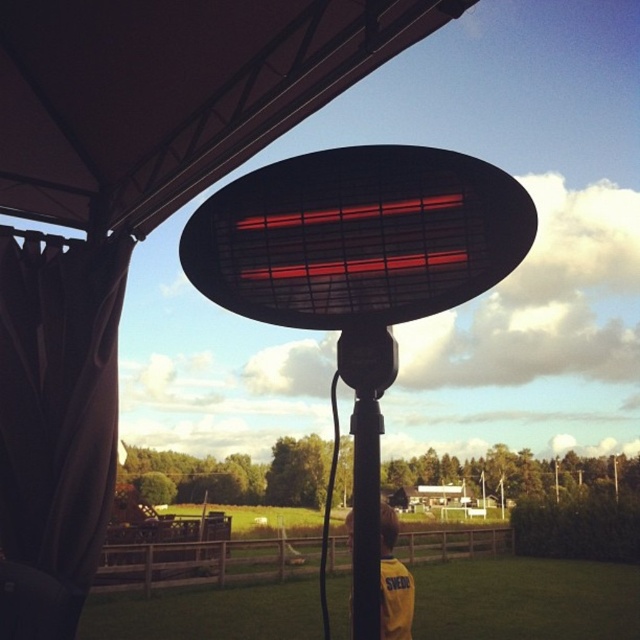
Question: Which point is farther to the camera?

Choices:
 (A) (374, 468)
 (B) (170, 49)
 (C) (490, 266)

Answer: (B)

Question: Which point is farther from the camera taking this photo?

Choices:
 (A) (403, 576)
 (B) (387, 216)
 (C) (358, 595)
 (D) (141, 236)

Answer: (D)

Question: Can you confirm if matte black canopy at upper center is smaller than black matte pole at center?

Choices:
 (A) no
 (B) yes

Answer: (A)

Question: In this image, where is black matte infrared heater at center located relative to yellow fabric at lower center?

Choices:
 (A) above
 (B) below

Answer: (A)

Question: Which point is farther to the camera?

Choices:
 (A) black matte infrared heater at center
 (B) black matte pole at center

Answer: (B)

Question: Is black matte pole at center wider than yellow fabric at lower center?

Choices:
 (A) yes
 (B) no

Answer: (B)